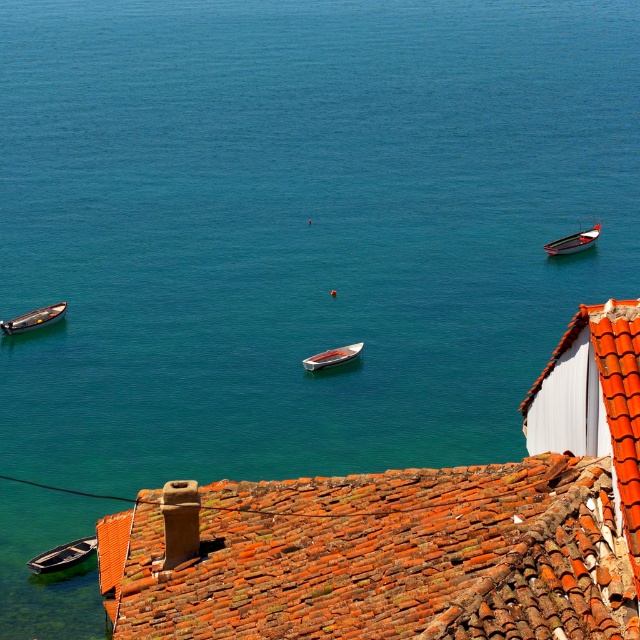
From the picture: Between wooden boat at lower left and metallic red boat at right, which one appears on the left side from the viewer's perspective?

Positioned to the left is wooden boat at lower left.

Who is positioned more to the right, wooden boat at lower left or metallic red boat at right?

Positioned to the right is metallic red boat at right.

Between point (35, 560) and point (573, 243), which one is positioned behind?

The point (573, 243) is more distant.

This screenshot has height=640, width=640. In order to click on wooden boat at lower left in this screenshot , I will do `click(61, 556)`.

Between metallic red boat at right and wooden boat at center, which one has more height?

metallic red boat at right is taller.

Is metallic red boat at right shorter than wooden boat at center?

Incorrect, metallic red boat at right's height does not fall short of wooden boat at center's.

You are a GUI agent. You are given a task and a screenshot of the screen. Output one action in this format:
    pyautogui.click(x=<x>, y=<y>)
    Task: Click on the metallic red boat at right
    The height and width of the screenshot is (640, 640).
    Given the screenshot: What is the action you would take?
    pyautogui.click(x=576, y=237)

You are a GUI agent. You are given a task and a screenshot of the screen. Output one action in this format:
    pyautogui.click(x=<x>, y=<y>)
    Task: Click on the metallic red boat at right
    
    Given the screenshot: What is the action you would take?
    pyautogui.click(x=576, y=237)

Is wooden boat at lower left bigger than wooden boat at left?

Yes, wooden boat at lower left is bigger than wooden boat at left.

Does point (45, 564) lie behind point (8, 324)?

No, it is in front of (8, 324).

Describe the element at coordinates (61, 556) in the screenshot. This screenshot has width=640, height=640. I see `wooden boat at lower left` at that location.

Find the location of `wooden boat at lower left`. wooden boat at lower left is located at coordinates (61, 556).